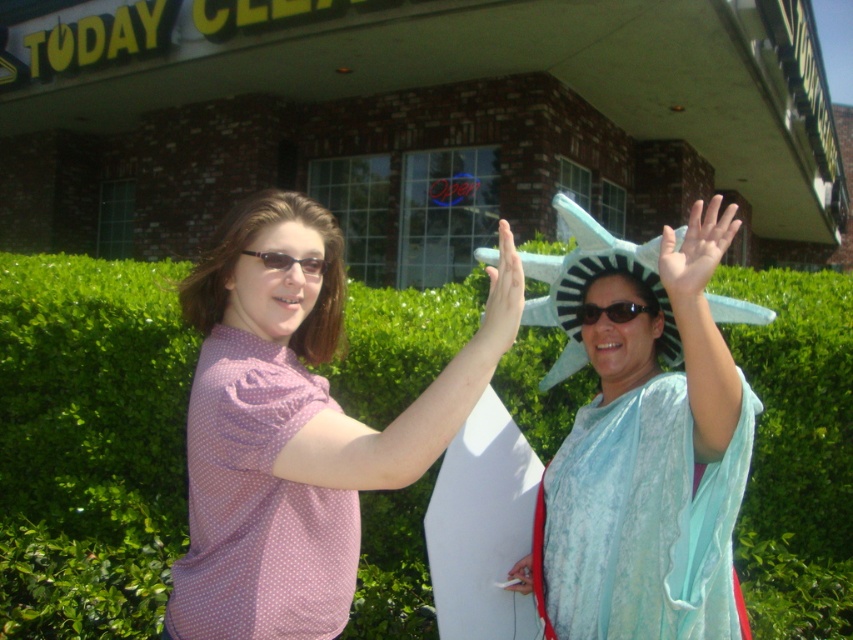
Question: Does green leafy hedge at center have a greater width compared to matte blue statue at center?

Choices:
 (A) yes
 (B) no

Answer: (A)

Question: Is the position of pink polka dot shirt at center less distant than that of black plastic sunglasses at center?

Choices:
 (A) yes
 (B) no

Answer: (A)

Question: Based on their relative distances, which object is nearer to the green leafy hedge at center?

Choices:
 (A) matte black sunglasses at center
 (B) pink polka dot shirt at center

Answer: (B)

Question: Among these objects, which one is farthest from the camera?

Choices:
 (A) black plastic sunglasses at center
 (B) green leafy hedge at center
 (C) matte blue statue at center
 (D) matte black sunglasses at center

Answer: (B)

Question: Observing the image, what is the correct spatial positioning of pink polka dot shirt at center in reference to matte blue statue at center?

Choices:
 (A) below
 (B) above

Answer: (A)

Question: Estimate the real-world distances between objects in this image. Which object is farther from the green leafy hedge at center?

Choices:
 (A) black plastic sunglasses at center
 (B) matte blue statue at center
 (C) matte black sunglasses at center
 (D) pink polka dot shirt at center

Answer: (C)